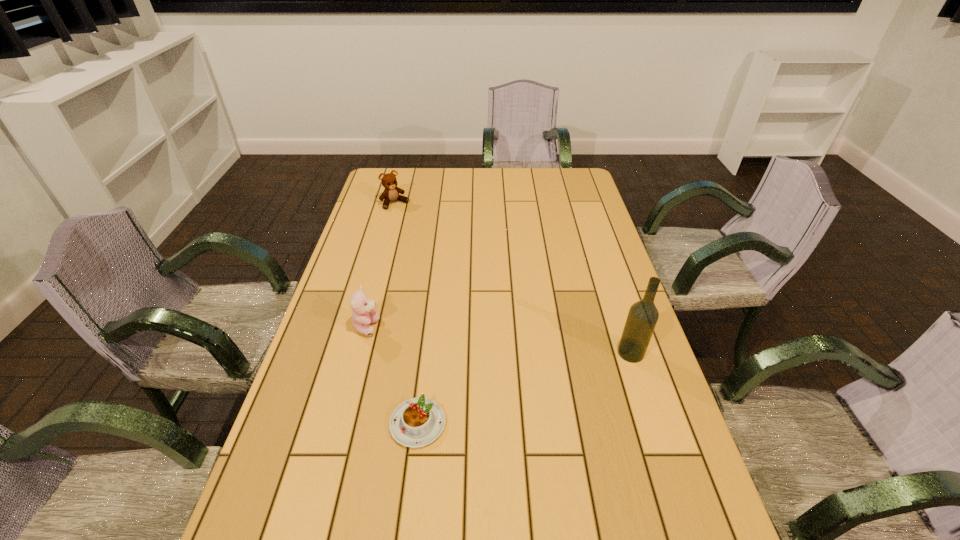
Choose which object is the second nearest neighbor to the third nearest object. Please provide its 2D coordinates. Your answer should be formatted as a tuple, i.e. [(x, y)], where the tuple contains the x and y coordinates of a point satisfying the conditions above.

[(391, 192)]

Identify which object is located as the third nearest to the nearer teddy bear. Please provide its 2D coordinates. Your answer should be formatted as a tuple, i.e. [(x, y)], where the tuple contains the x and y coordinates of a point satisfying the conditions above.

[(643, 315)]